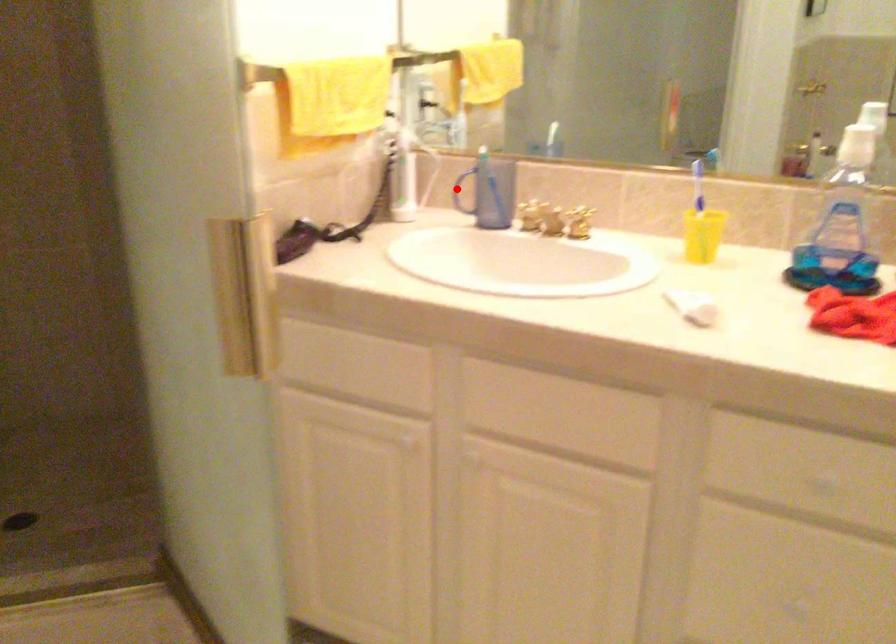
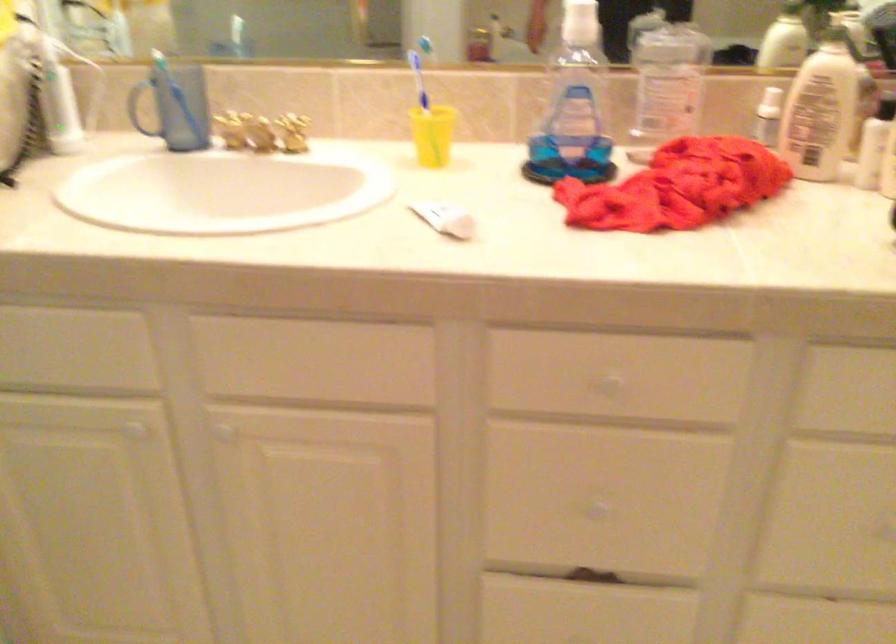
Question: I am providing you with two images of the same scene from different viewpoints. Image1 has a red point marked. In image2, the corresponding 3D location appears at what relative position? Reply with the corresponding letter.

Choices:
 (A) Closer
 (B) Farther

Answer: (A)